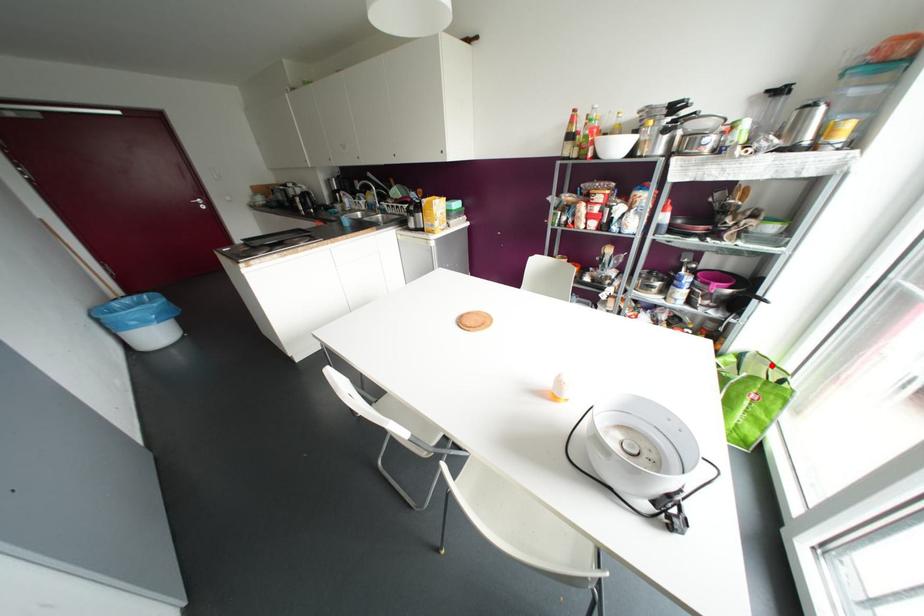
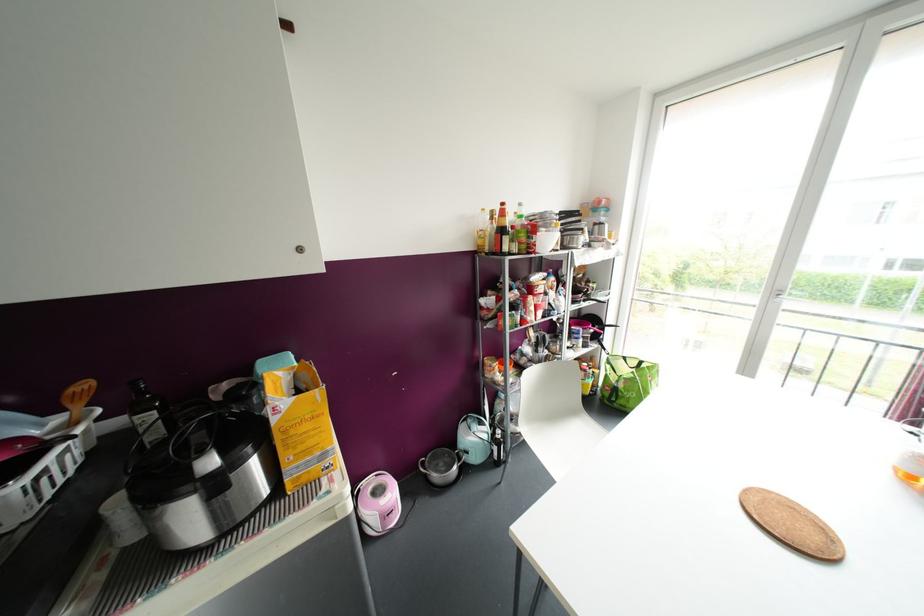
Question: I am providing you with two images of the same scene from different viewpoints. Given a red point in image1, look at the same physical point in image2. Is it:

Choices:
 (A) Closer to the viewpoint
 (B) Farther from the viewpoint

Answer: (B)